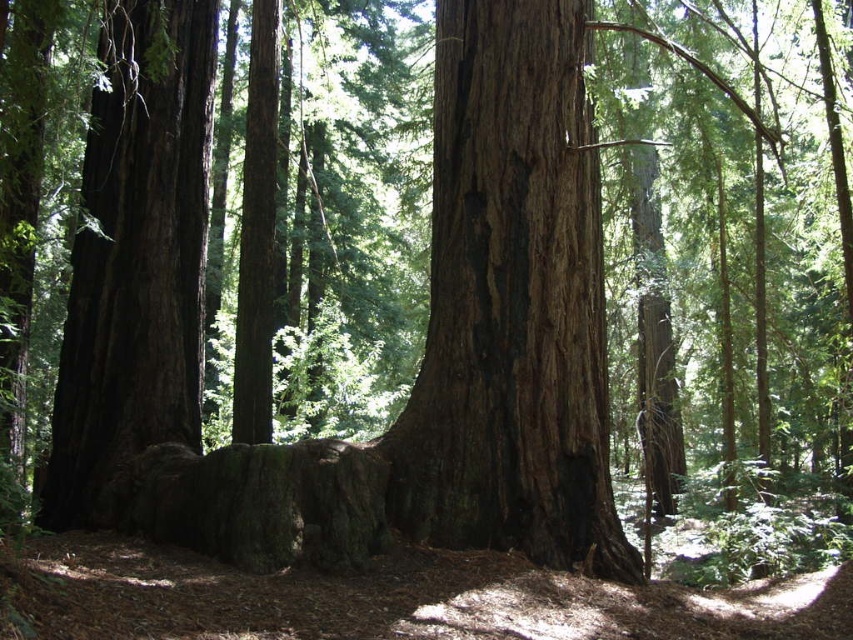
You are standing in a forest and want to take a photo of the dark brown rough bark tree trunk at center. If your camera can focus on objects up to 6 meters away, will you need to move closer or farther away to get a clear shot?

The dark brown rough bark tree trunk at center is 5.79 meters away from you. Since your camera can focus up to 6 meters, you don not need to move closer or farther away. You can take the photo from your current position.

You are standing in the forest and want to find the dark brown rough bark tree trunk at center. According to the coordinates provided, where should you look relative to your position?

The dark brown rough bark tree trunk at center is located at coordinates point (511,304), which means it is positioned slightly to the right and below your central line of sight.